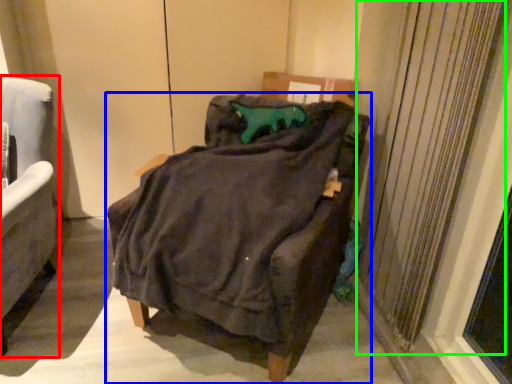
Question: Which object is positioned farthest from chair (highlighted by a red box)? Select from chair (highlighted by a blue box) and curtain (highlighted by a green box).

Choices:
 (A) chair
 (B) curtain

Answer: (B)